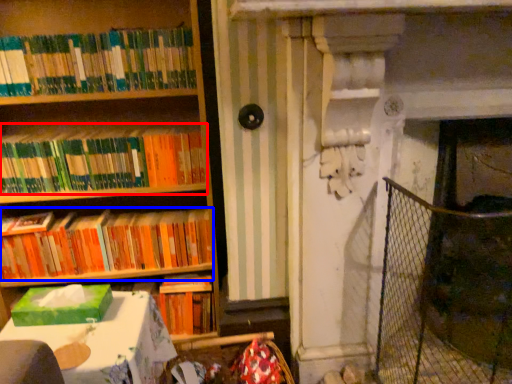
Question: Which of the following is the farthest to the observer, book (highlighted by a red box) or book (highlighted by a blue box)?

Choices:
 (A) book
 (B) book

Answer: (B)